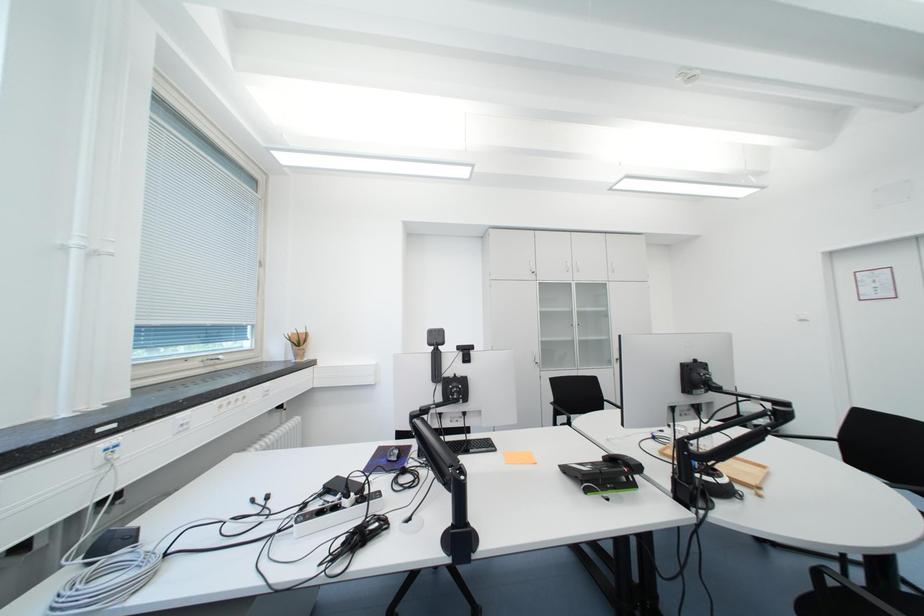
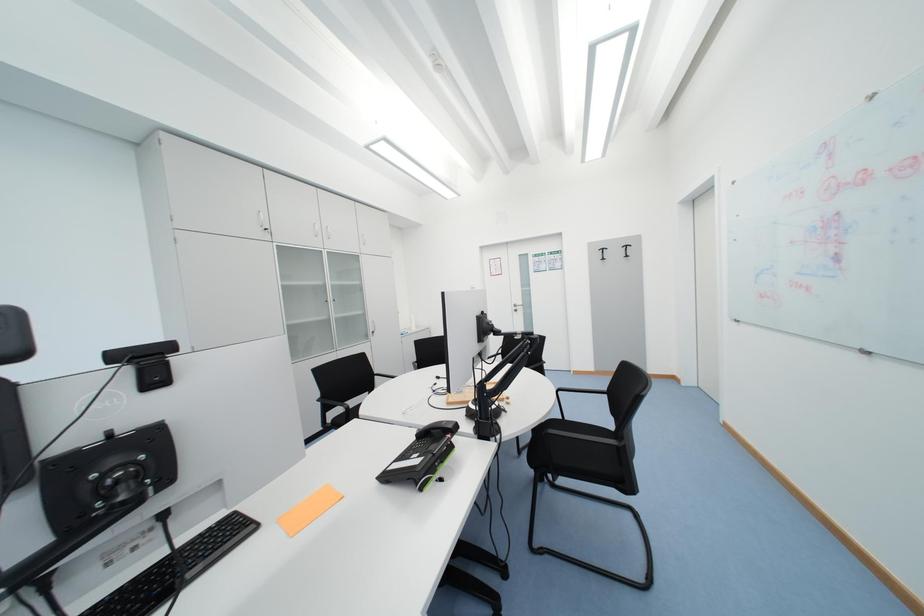
Question: The camera is either moving clockwise (left) or counter-clockwise (right) around the object. The first image is from the beginning of the video and the second image is from the end. Is the camera moving left or right when shooting the video?

Choices:
 (A) Left
 (B) Right

Answer: (A)